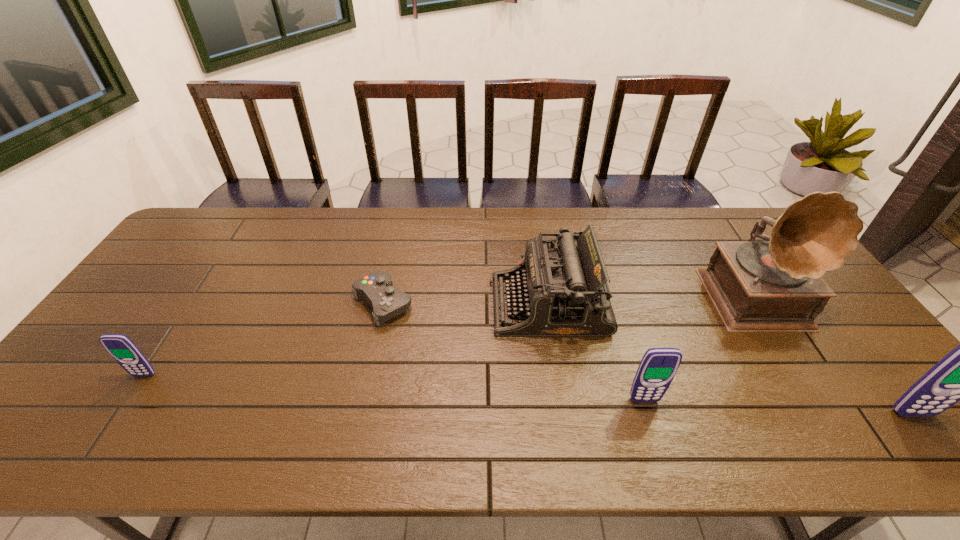
I want to click on vacant area that lies between the second cellular telephone from right to left and the typewriter, so point(596,353).

You are a GUI agent. You are given a task and a screenshot of the screen. Output one action in this format:
    pyautogui.click(x=<x>, y=<y>)
    Task: Click on the free area in between the tallest object and the typewriter
    
    Given the screenshot: What is the action you would take?
    pyautogui.click(x=656, y=301)

Find the location of a particular element. This screenshot has height=540, width=960. free spot between the nearest cellular telephone and the record player is located at coordinates (838, 356).

Find the location of a particular element. empty space between the record player and the nearest cellular telephone is located at coordinates (838, 356).

Find the location of `object that ranks as the second closest to the typewriter`. object that ranks as the second closest to the typewriter is located at coordinates (377, 288).

Identify which object is located as the nearest to the typewriter. Please provide its 2D coordinates. Your answer should be formatted as a tuple, i.e. [(x, y)], where the tuple contains the x and y coordinates of a point satisfying the conditions above.

[(658, 366)]

Locate an element on the screen. cellular telephone that is the closest to the shortest object is located at coordinates (120, 347).

You are a GUI agent. You are given a task and a screenshot of the screen. Output one action in this format:
    pyautogui.click(x=<x>, y=<y>)
    Task: Click on the cellular telephone identified as the closest to the fifth tallest object
    The height and width of the screenshot is (540, 960).
    Given the screenshot: What is the action you would take?
    pyautogui.click(x=658, y=366)

Find the location of a particular element. vacant point that satisfies the following two spatial constraints: 1. on the keyboard of the typewriter; 2. on the front-facing side of the leftmost cellular telephone is located at coordinates (560, 375).